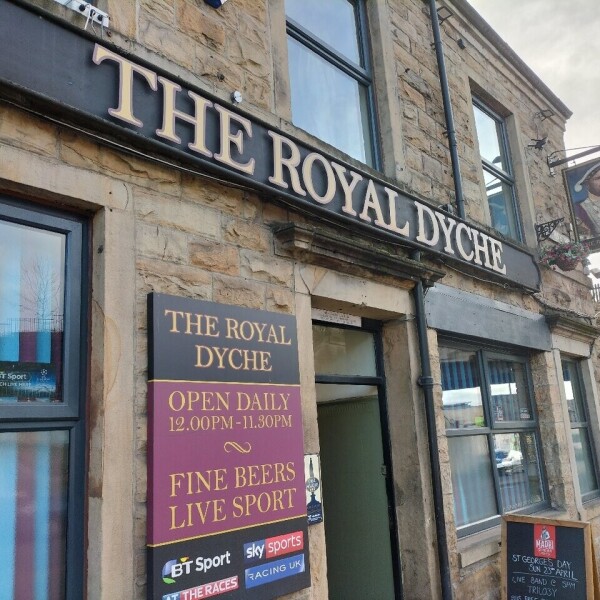
You are a GUI agent. You are given a task and a screenshot of the screen. Output one action in this format:
    pyautogui.click(x=<x>, y=<y>)
    Task: Click on the painting
    This screenshot has width=600, height=600.
    Given the screenshot: What is the action you would take?
    pyautogui.click(x=584, y=187)